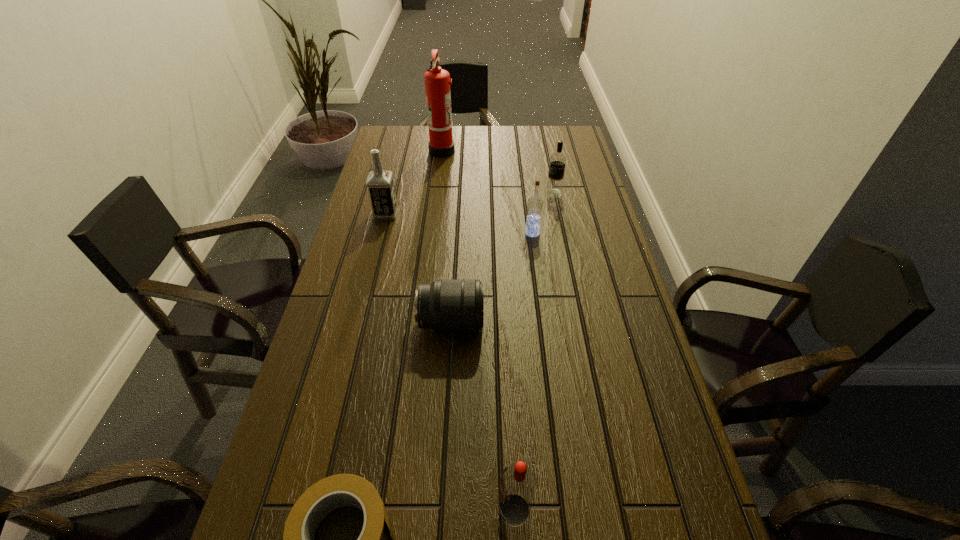
The width and height of the screenshot is (960, 540). Find the location of `fire extinguisher`. fire extinguisher is located at coordinates (437, 81).

What are the coordinates of `the farthest object` in the screenshot? It's located at (437, 81).

This screenshot has height=540, width=960. What are the coordinates of `the fifth nearest object` in the screenshot? It's located at (380, 185).

Find the location of a particular element. The image size is (960, 540). the second farthest vodka is located at coordinates (380, 185).

Identify the location of the sixth nearest object. This screenshot has width=960, height=540. (554, 188).

Identify the location of the rightmost object. (554, 188).

Identify the location of the fourth farthest object. This screenshot has width=960, height=540. (534, 204).

Identify the location of the third vodka from left to right. The image size is (960, 540). (534, 204).

Where is `the nearest vodka`? This screenshot has width=960, height=540. the nearest vodka is located at coordinates (518, 483).

I want to click on the fifth object from left to right, so click(x=518, y=483).